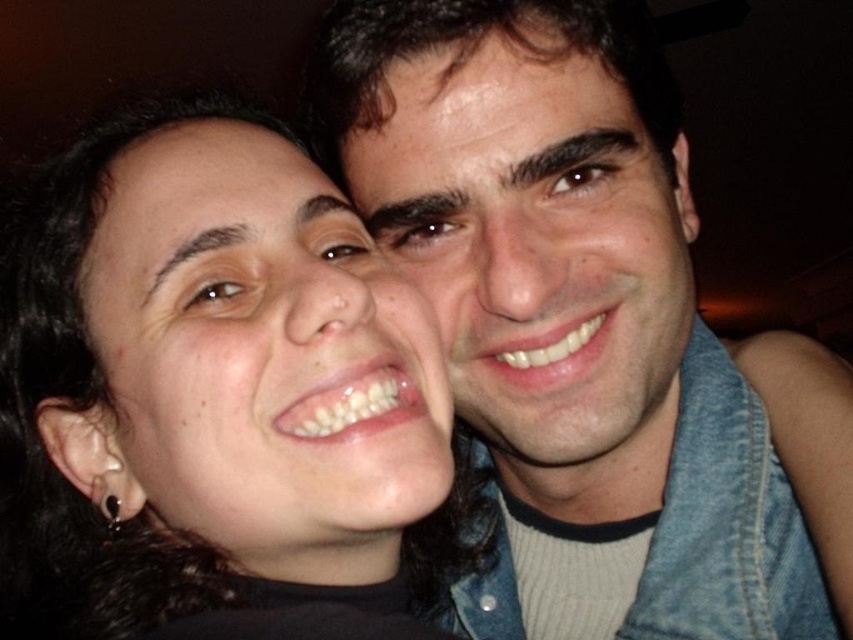
Question: Which point appears farthest from the camera in this image?

Choices:
 (A) (546, 344)
 (B) (144, 381)
 (C) (767, 579)

Answer: (C)

Question: Among these points, which one is nearest to the camera?

Choices:
 (A) (746, 552)
 (B) (442, 140)
 (C) (347, 528)

Answer: (C)

Question: Is the position of matte skin face at center more distant than that of smooth skin face at center?

Choices:
 (A) no
 (B) yes

Answer: (A)

Question: Does matte skin face at center have a lesser width compared to smooth skin face at center?

Choices:
 (A) yes
 (B) no

Answer: (A)

Question: Which point appears closest to the camera in this image?

Choices:
 (A) (561, 404)
 (B) (531, 412)
 (C) (103, 484)

Answer: (C)

Question: Can you confirm if matte skin face at center is smaller than smooth skin face at center?

Choices:
 (A) no
 (B) yes

Answer: (B)